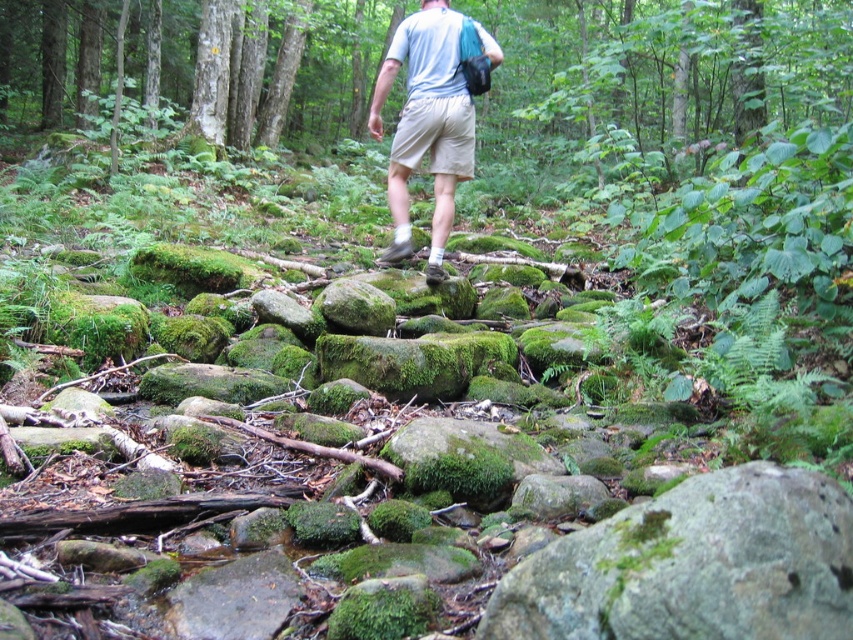
Question: Can you confirm if green mossy rock at center is wider than beige cotton shorts at center?

Choices:
 (A) yes
 (B) no

Answer: (A)

Question: Is light beige shorts at center thinner than beige cotton shorts at center?

Choices:
 (A) yes
 (B) no

Answer: (B)

Question: Is green mossy rock at center closer to camera compared to light beige shorts at center?

Choices:
 (A) no
 (B) yes

Answer: (B)

Question: Which object appears closest to the camera in this image?

Choices:
 (A) light beige shorts at center
 (B) beige cotton shorts at center
 (C) green mossy rock at center

Answer: (C)

Question: Which is farther from the beige cotton shorts at center?

Choices:
 (A) light beige shorts at center
 (B) green mossy rock at center

Answer: (B)

Question: Which object is positioned closest to the light beige shorts at center?

Choices:
 (A) beige cotton shorts at center
 (B) green mossy rock at center

Answer: (A)